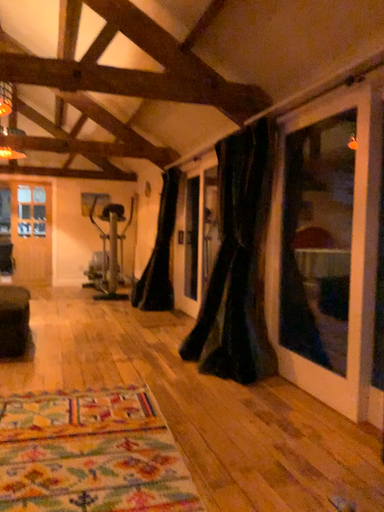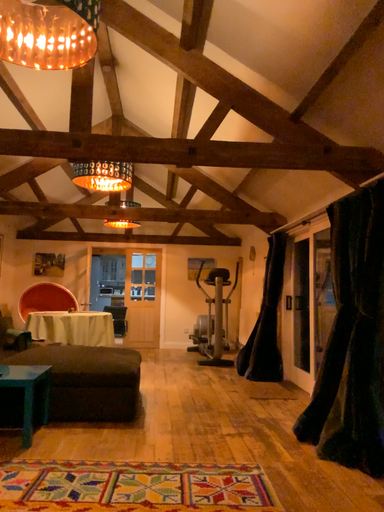
Question: How did the camera likely rotate when shooting the video?

Choices:
 (A) rotated right
 (B) rotated left

Answer: (B)